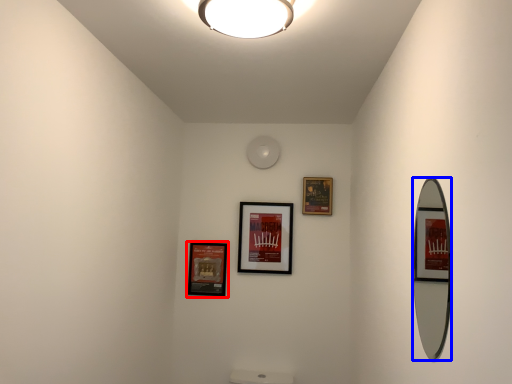
Question: Which of the following is the farthest to the observer, picture frame (highlighted by a red box) or mirror (highlighted by a blue box)?

Choices:
 (A) picture frame
 (B) mirror

Answer: (A)